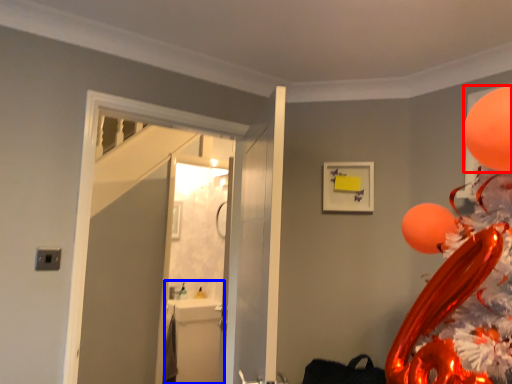
Question: Which point is further to the camera, balloon (highlighted by a red box) or sink (highlighted by a blue box)?

Choices:
 (A) balloon
 (B) sink

Answer: (B)